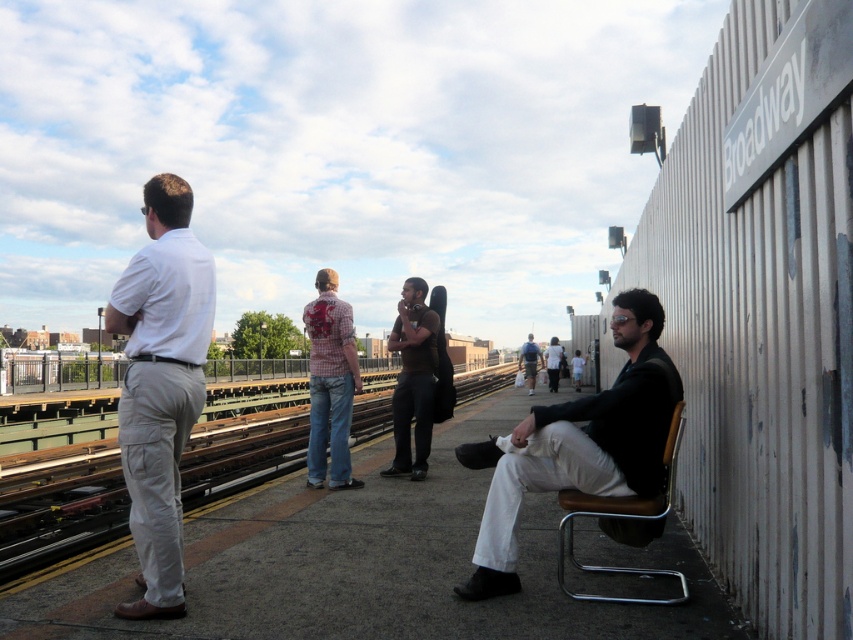
Which is more to the right, brown matte guitar case at center or white cotton shirt at center?

white cotton shirt at center is more to the right.

Does point (438, 320) lie behind point (549, 385)?

That is False.

This screenshot has height=640, width=853. What are the coordinates of `brown matte guitar case at center` in the screenshot? It's located at (413, 378).

Is brown matte guitar case at center to the right of light blue jeans at center from the viewer's perspective?

In fact, brown matte guitar case at center is to the left of light blue jeans at center.

Is brown matte guitar case at center further to the viewer compared to light blue jeans at center?

No, brown matte guitar case at center is closer to the viewer.

Between point (432, 371) and point (531, 339), which one is positioned in front?

Point (432, 371) is more forward.

Identify the location of brown matte guitar case at center. The width and height of the screenshot is (853, 640). (413, 378).

Looking at this image, can you confirm if smooth metal train track at lower left is wider than light blue jeans at center?

Indeed, smooth metal train track at lower left has a greater width compared to light blue jeans at center.

Is point (50, 508) in front of point (532, 358)?

That is True.

At what (x,y) coordinates should I click in order to perform the action: click on smooth metal train track at lower left. Please return your answer as a coordinate pair (x, y). Looking at the image, I should click on (61, 516).